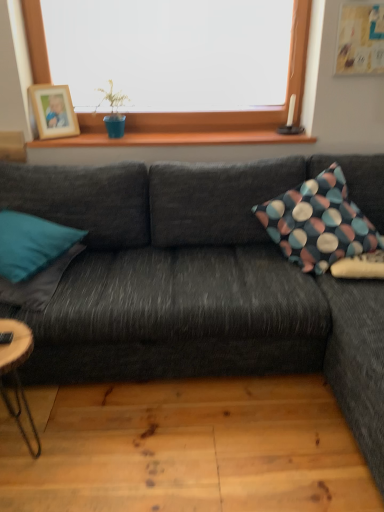
Question: Considering the relative sizes of teal fabric pillow at left, marked as the 3th pillow in a right-to-left arrangement, and teal fabric pillow at left, the second pillow viewed from the left, in the image provided, is teal fabric pillow at left, marked as the 3th pillow in a right-to-left arrangement, taller than teal fabric pillow at left, the second pillow viewed from the left,?

Choices:
 (A) no
 (B) yes

Answer: (B)

Question: Does teal fabric pillow at left, arranged as the 1th pillow when viewed from the left, have a lesser width compared to teal fabric pillow at left, the second pillow viewed from the left?

Choices:
 (A) yes
 (B) no

Answer: (B)

Question: Can you confirm if teal fabric pillow at left, marked as the 3th pillow in a right-to-left arrangement, is shorter than teal fabric pillow at left, the second pillow viewed from the left?

Choices:
 (A) no
 (B) yes

Answer: (A)

Question: From a real-world perspective, is teal fabric pillow at left, arranged as the 1th pillow when viewed from the left, located beneath teal fabric pillow at left, the second pillow positioned from the right?

Choices:
 (A) yes
 (B) no

Answer: (B)

Question: Is teal fabric pillow at left, arranged as the 1th pillow when viewed from the left, positioned far away from teal fabric pillow at left, the second pillow positioned from the right?

Choices:
 (A) yes
 (B) no

Answer: (B)

Question: Is teal fabric pillow at left, marked as the 3th pillow in a right-to-left arrangement, further to the viewer compared to teal fabric pillow at left, the second pillow viewed from the left?

Choices:
 (A) no
 (B) yes

Answer: (A)

Question: Considering the relative positions of teal fabric pillow at left, marked as the 3th pillow in a right-to-left arrangement, and dark gray fabric couch at center in the image provided, is teal fabric pillow at left, marked as the 3th pillow in a right-to-left arrangement, in front of dark gray fabric couch at center?

Choices:
 (A) no
 (B) yes

Answer: (A)

Question: From the image's perspective, is teal fabric pillow at left, marked as the 3th pillow in a right-to-left arrangement, located above dark gray fabric couch at center?

Choices:
 (A) no
 (B) yes

Answer: (B)

Question: Are teal fabric pillow at left, marked as the 3th pillow in a right-to-left arrangement, and dark gray fabric couch at center far apart?

Choices:
 (A) no
 (B) yes

Answer: (A)

Question: Is teal fabric pillow at left, marked as the 3th pillow in a right-to-left arrangement, aimed at dark gray fabric couch at center?

Choices:
 (A) no
 (B) yes

Answer: (B)

Question: Is dark gray fabric couch at center at the back of teal fabric pillow at left, marked as the 3th pillow in a right-to-left arrangement?

Choices:
 (A) no
 (B) yes

Answer: (B)

Question: Does teal fabric pillow at left, marked as the 3th pillow in a right-to-left arrangement, appear on the left side of dark gray fabric couch at center?

Choices:
 (A) no
 (B) yes

Answer: (B)

Question: Does dark gray fabric couch at center have a lesser width compared to wooden natural coffee table at lower left?

Choices:
 (A) no
 (B) yes

Answer: (A)